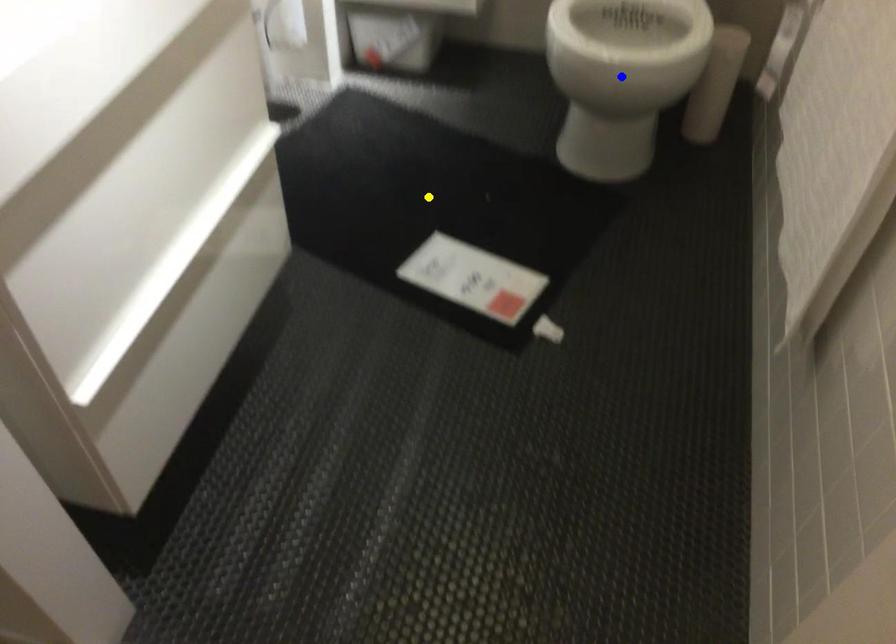
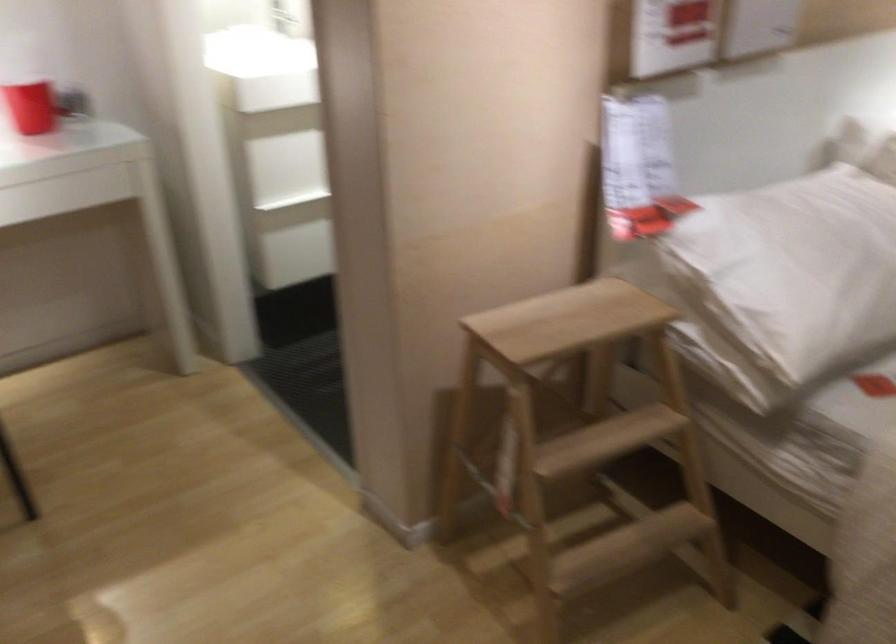
I am providing you with two images of the same scene from different viewpoints. Three points are marked in image1. Which point corresponds to a part or object that is occluded in image2?In image1, three points are marked. Which of them correspond to a part or object that is occluded in image2?Among the three points shown in image1, which one corresponds to a part or object that is no longer visible due to occlusion in image2?

green point, yellow point, blue point